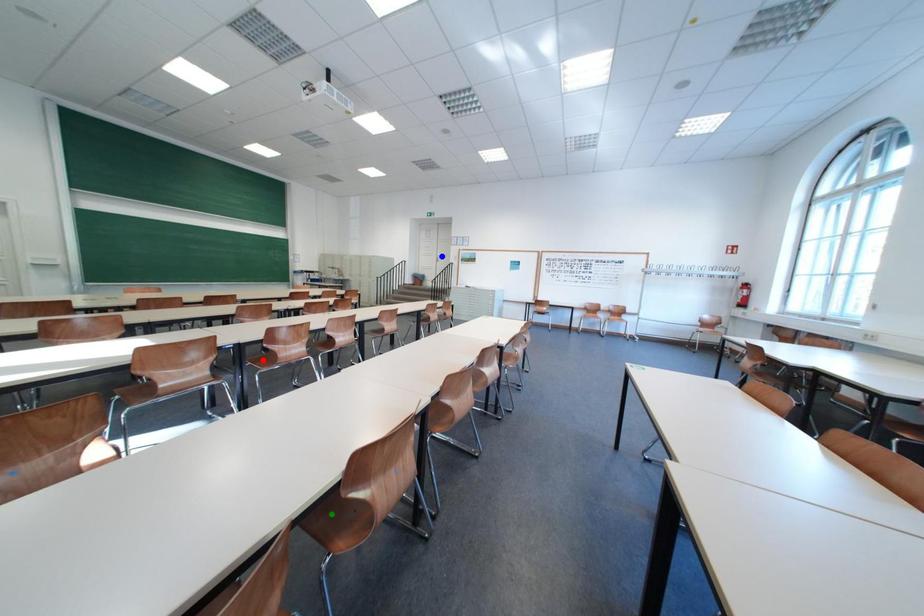
Order these from nearest to farthest:
blue point
red point
green point

green point
red point
blue point